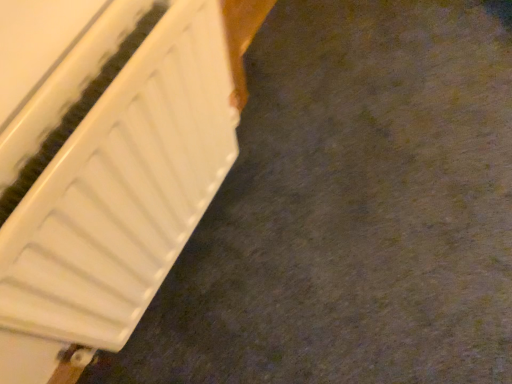
This screenshot has height=384, width=512. Describe the element at coordinates (114, 176) in the screenshot. I see `white matte radiator at left` at that location.

Find the location of a particular element. The height and width of the screenshot is (384, 512). white matte radiator at left is located at coordinates (114, 176).

I want to click on white matte radiator at left, so click(x=114, y=176).